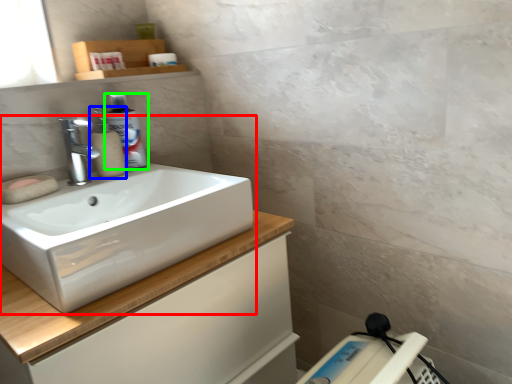
Question: Which object is the farthest from sink (highlighted by a red box)? Choose among these: soap dispenser (highlighted by a blue box) or cleaning product (highlighted by a green box).

Choices:
 (A) soap dispenser
 (B) cleaning product

Answer: (B)